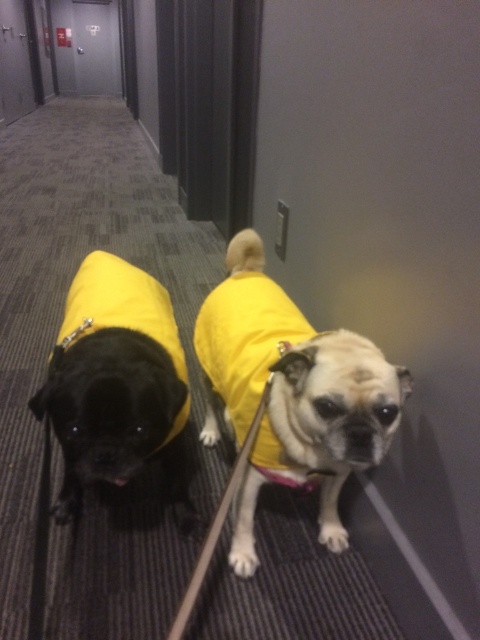
You are a photographer trying to capture both the yellow fabric dog at center and the shiny black pug at left in a single frame. Given their sizes, which dog should you focus on first to ensure both fit in the photo?

The yellow fabric dog at center is larger in size than the shiny black pug at left, so you should focus on the yellow fabric dog at center first to ensure it fits properly, then adjust the frame to include the smaller shiny black pug at left.

You are standing in the hallway and see two points marked on the floor. The first point is at coordinate point (340,380) and the second is at point (175,339). If you want to walk towards the direction where the dogs are moving, which point should you step on first?

You should step on point (175,339) first because it is behind point (340,380), indicating that the dogs are moving towards the latter point.

You are a dog owner who wants to ensure your dogs are safe while walking them down the hallway. Given the positions of the yellow fabric dog at center and the shiny black pug at left, which dog is more likely to be tripped over by someone entering the hallway?

The shiny black pug at left is more likely to be tripped over because it is located below the yellow fabric dog at center, meaning it is closer to the floor where someone might step on the leash or the dog itself.